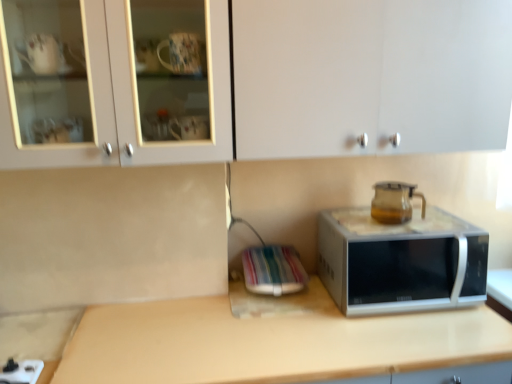
This screenshot has height=384, width=512. What are the coordinates of `free space above silver metallic microwave at center (from a real-world perspective)` in the screenshot? It's located at (395, 227).